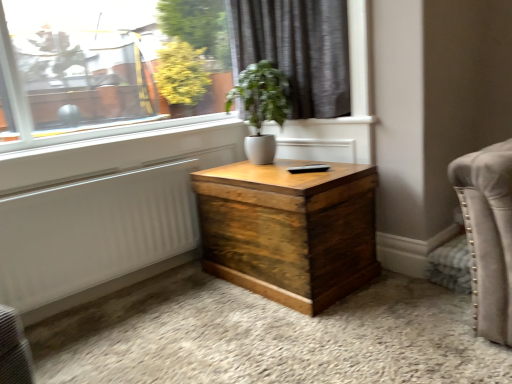
Question: From a real-world perspective, is white smooth window sill at upper center physically located above or below white glossy vase at center?

Choices:
 (A) above
 (B) below

Answer: (B)

Question: Is white smooth window sill at upper center situated inside white glossy vase at center or outside?

Choices:
 (A) inside
 (B) outside

Answer: (B)

Question: Estimate the real-world distances between objects in this image. Which object is farther from the white textured radiator at lower left?

Choices:
 (A) dark grey fabric curtain at upper center
 (B) white glossy vase at center
 (C) white smooth window sill at upper center
 (D) rustic wood trunk at center

Answer: (A)

Question: Which of these objects is positioned closest to the dark grey fabric curtain at upper center?

Choices:
 (A) rustic wood trunk at center
 (B) white glossy vase at center
 (C) white smooth window sill at upper center
 (D) white textured radiator at lower left

Answer: (B)